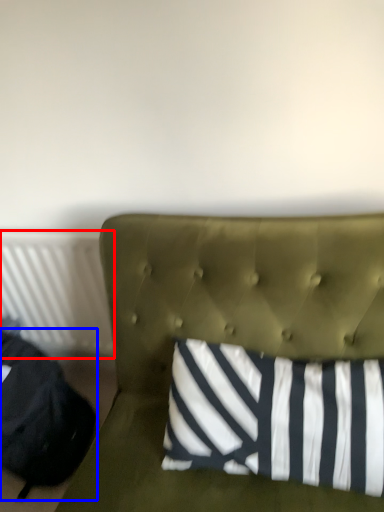
Question: Which point is further to the camera, radiator (highlighted by a red box) or bean bag chair (highlighted by a blue box)?

Choices:
 (A) radiator
 (B) bean bag chair

Answer: (A)